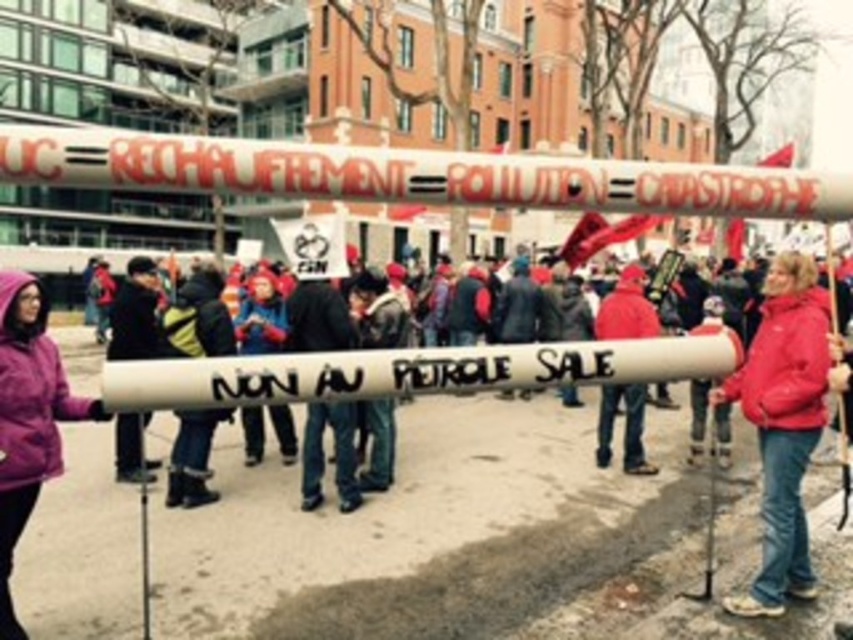
Question: Does red fleece jacket at lower right have a smaller size compared to purple fleece jacket at left?

Choices:
 (A) yes
 (B) no

Answer: (A)

Question: Estimate the real-world distances between objects in this image. Which object is closer to the red woolen hat at center?

Choices:
 (A) purple fleece jacket at left
 (B) red fleece jacket at lower right

Answer: (B)

Question: Observing the image, what is the correct spatial positioning of red fleece jacket at lower right in reference to purple fleece jacket at left?

Choices:
 (A) below
 (B) above

Answer: (B)

Question: Among these objects, which one is nearest to the camera?

Choices:
 (A) red woolen hat at center
 (B) purple fleece jacket at left
 (C) red fleece jacket at lower right

Answer: (B)

Question: Which point is farther to the camera?

Choices:
 (A) click(x=1, y=534)
 (B) click(x=614, y=390)

Answer: (B)

Question: Observing the image, what is the correct spatial positioning of red fleece jacket at lower right in reference to purple fleece jacket at left?

Choices:
 (A) right
 (B) left

Answer: (A)